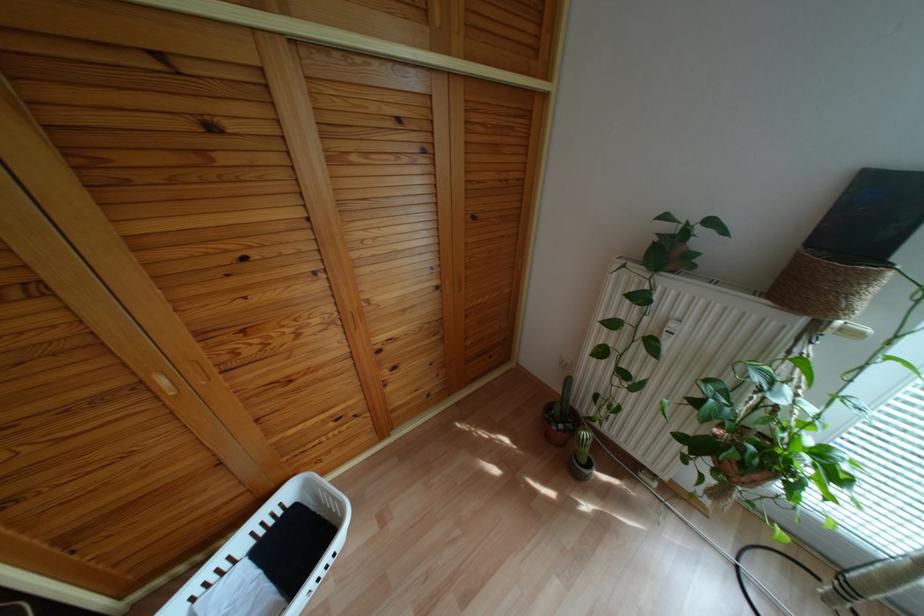
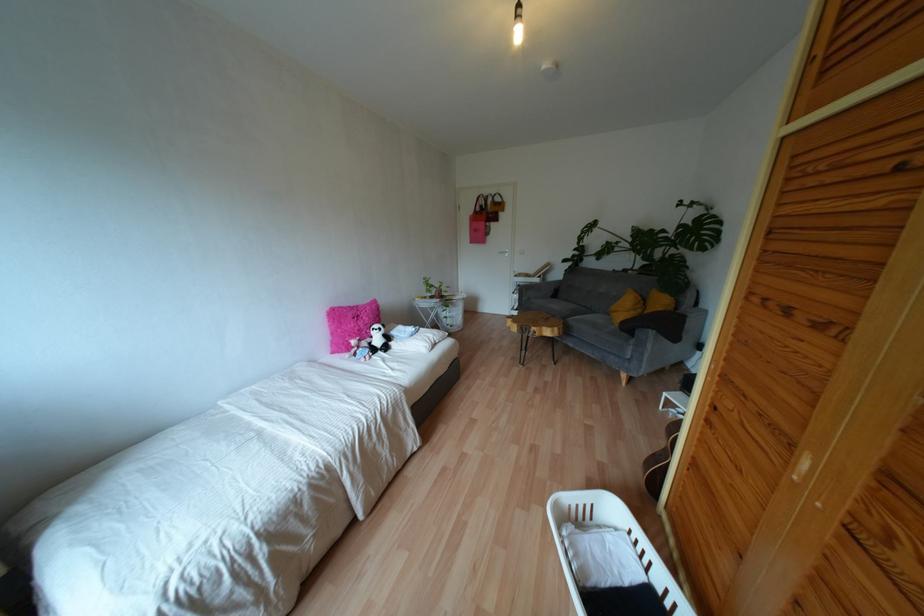
Where in the second image is the point corresponding to pixel 251 543 from the first image?

(660, 592)